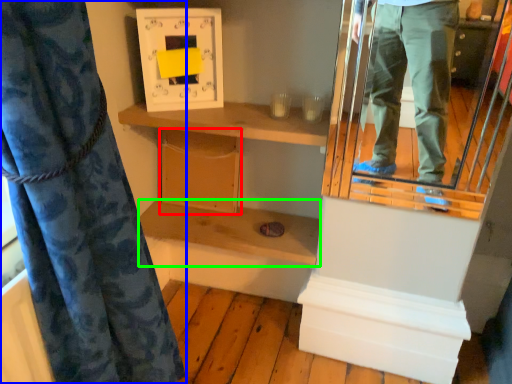
Question: Estimate the real-world distances between objects in this image. Which object is farther from cabinet (highlighted by a red box), curtain (highlighted by a blue box) or shelf (highlighted by a green box)?

Choices:
 (A) curtain
 (B) shelf

Answer: (A)